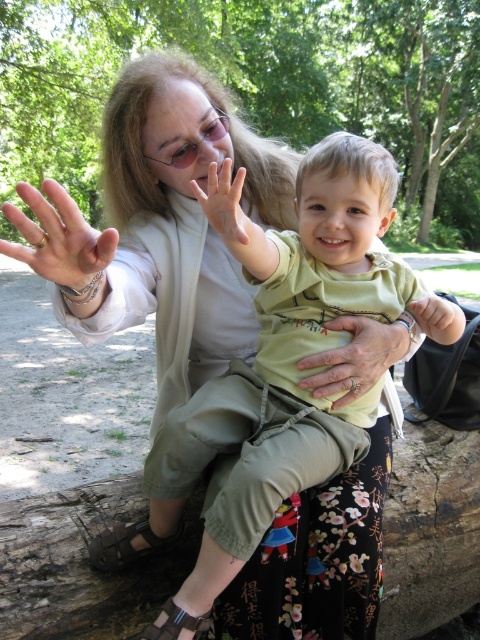
Question: Is green matte shirt at center below matte gold ring at center?

Choices:
 (A) no
 (B) yes

Answer: (B)

Question: Can you confirm if gold textured ring at center is bigger than matte skin hand at center?

Choices:
 (A) no
 (B) yes

Answer: (B)

Question: Does green matte shirt at center come in front of gold textured ring at center?

Choices:
 (A) yes
 (B) no

Answer: (A)

Question: Estimate the real-world distances between objects in this image. Which object is closer to the gold textured ring at center?

Choices:
 (A) green matte shirt at center
 (B) matte gold ring at center
 (C) matte skin hand at center

Answer: (A)

Question: Based on their relative distances, which object is nearer to the green matte shirt at center?

Choices:
 (A) matte gold ring at center
 (B) gold textured ring at center

Answer: (B)

Question: Which point appears closest to the camera in this image?

Choices:
 (A) (359, 342)
 (B) (43, 216)
 (C) (319, 483)
 (D) (228, 184)

Answer: (B)